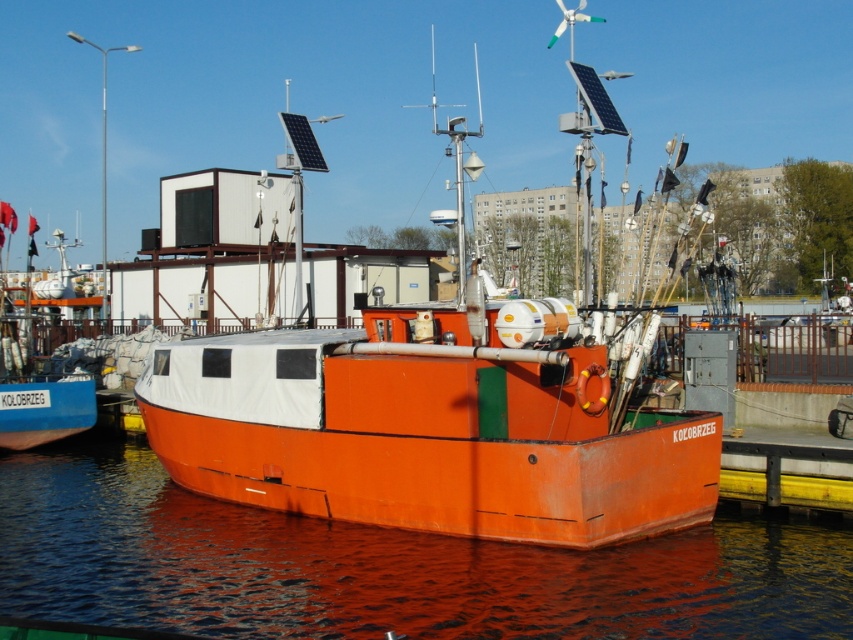
You are standing on the deck of the KOLOBRZEG fishing boat and notice two points marked on the deck. The first point is at coordinates point (558, 316) and the second is at point (94, 506). If you face the direction the boat is pointing, which point is closer to the front of the boat?

Point (558, 316) is in front of point (94, 506), so if you face the direction the boat is pointing, point (558, 316) is closer to the front of the boat.

You are a marine biologist studying the reflection patterns of water surfaces. You observe the glossy orange water at lower center. What are the coordinates of its position?

The coordinates of the glossy orange water at lower center are at point (384, 566).